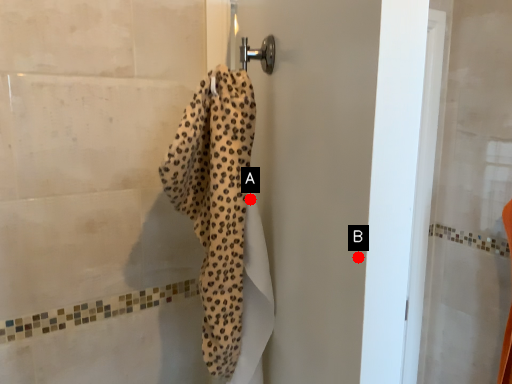
Question: Two points are circled on the image, labeled by A and B beside each circle. Among these points, which one is farthest from the camera?

Choices:
 (A) A is further
 (B) B is further

Answer: (A)